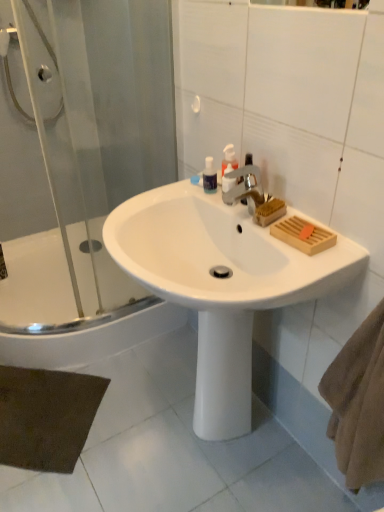
This screenshot has width=384, height=512. Identify the location of vacant area to the right of brown felt bath mat at lower left. (143, 422).